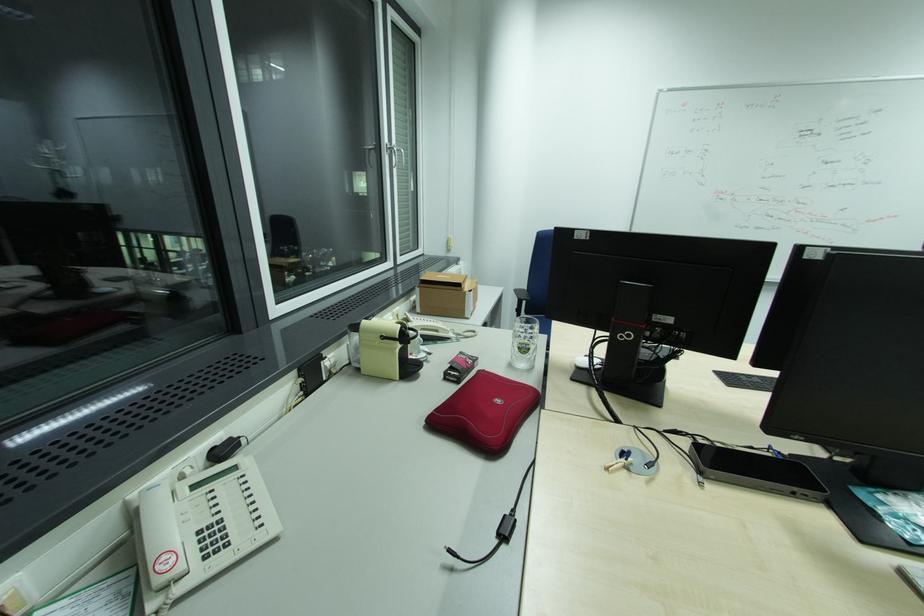
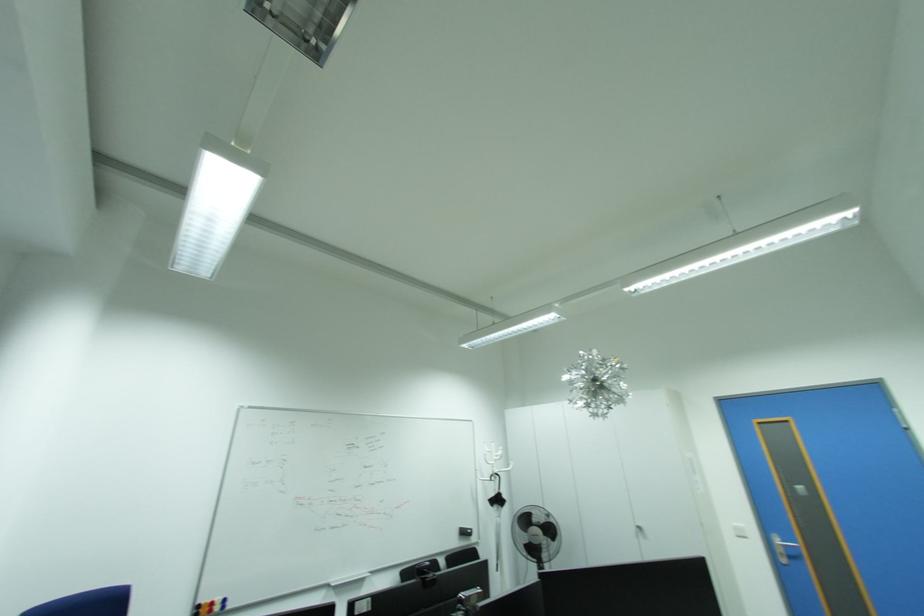
Based on the continuous images, in which direction is the camera rotating?

The rotation direction of the camera is right-up.